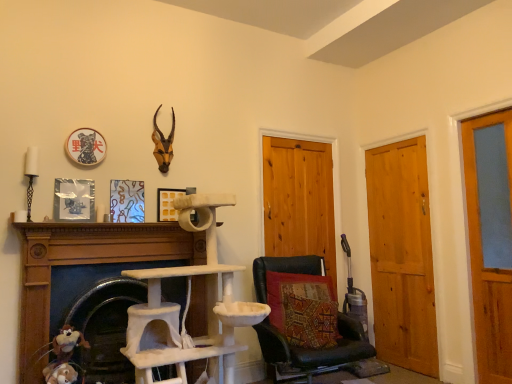
Question: Is fuzzy fabric stuffed animal at lower left positioned far away from white textured cat tree at center, the first fireplace viewed from the left?

Choices:
 (A) no
 (B) yes

Answer: (A)

Question: Is fuzzy fabric stuffed animal at lower left aimed at white textured cat tree at center, which ranks as the 2th fireplace in right-to-left order?

Choices:
 (A) yes
 (B) no

Answer: (B)

Question: Is fuzzy fabric stuffed animal at lower left completely or partially outside of white textured cat tree at center, the first fireplace viewed from the left?

Choices:
 (A) yes
 (B) no

Answer: (A)

Question: Is fuzzy fabric stuffed animal at lower left turned away from white textured cat tree at center, the first fireplace viewed from the left?

Choices:
 (A) yes
 (B) no

Answer: (A)

Question: Can you confirm if fuzzy fabric stuffed animal at lower left is smaller than white textured cat tree at center, the first fireplace viewed from the left?

Choices:
 (A) yes
 (B) no

Answer: (A)

Question: Considering the relative sizes of fuzzy fabric stuffed animal at lower left and white textured cat tree at center, which ranks as the 2th fireplace in right-to-left order, in the image provided, is fuzzy fabric stuffed animal at lower left thinner than white textured cat tree at center, which ranks as the 2th fireplace in right-to-left order,?

Choices:
 (A) yes
 (B) no

Answer: (A)

Question: Considering the relative sizes of wooden door at right, positioned as the 1th door in right-to-left order, and white textured cat tree at center, the first fireplace viewed from the left, in the image provided, is wooden door at right, positioned as the 1th door in right-to-left order, taller than white textured cat tree at center, the first fireplace viewed from the left,?

Choices:
 (A) yes
 (B) no

Answer: (A)

Question: From the image's perspective, is wooden door at right, positioned as the 1th door in right-to-left order, located above white textured cat tree at center, which ranks as the 2th fireplace in right-to-left order?

Choices:
 (A) no
 (B) yes

Answer: (B)

Question: From a real-world perspective, does wooden door at right, which is the 3th door from left to right, stand above white textured cat tree at center, which ranks as the 2th fireplace in right-to-left order?

Choices:
 (A) yes
 (B) no

Answer: (A)

Question: Does wooden door at right, which is the 3th door from left to right, have a greater width compared to white textured cat tree at center, the first fireplace viewed from the left?

Choices:
 (A) yes
 (B) no

Answer: (B)

Question: From the image's perspective, does wooden door at right, which is the 3th door from left to right, appear lower than white textured cat tree at center, which ranks as the 2th fireplace in right-to-left order?

Choices:
 (A) no
 (B) yes

Answer: (A)

Question: Is wooden door at right, which is the 3th door from left to right, at the left side of white textured cat tree at center, the first fireplace viewed from the left?

Choices:
 (A) no
 (B) yes

Answer: (A)

Question: Can you confirm if fuzzy fabric stuffed animal at lower left is bigger than wooden door at center, the third door in the right-to-left sequence?

Choices:
 (A) no
 (B) yes

Answer: (A)